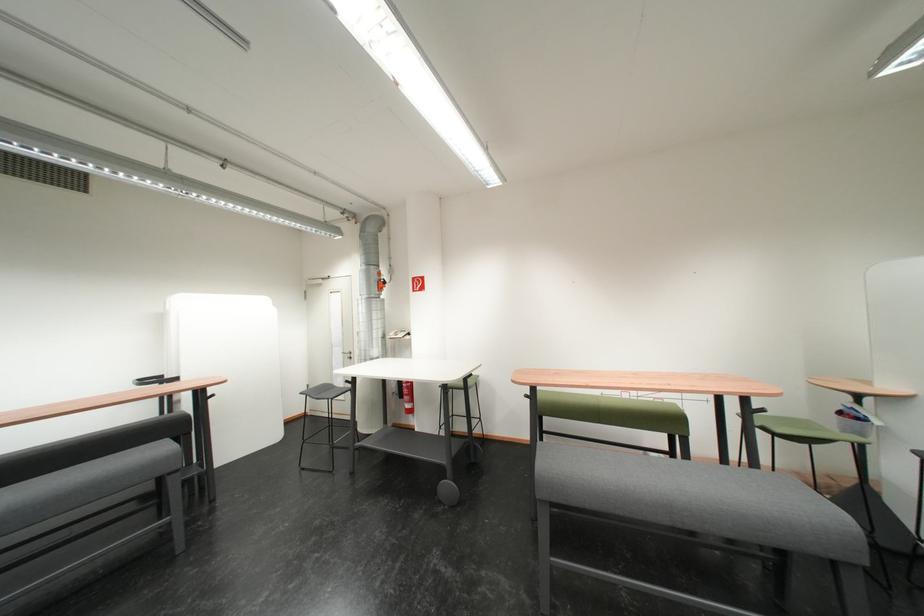
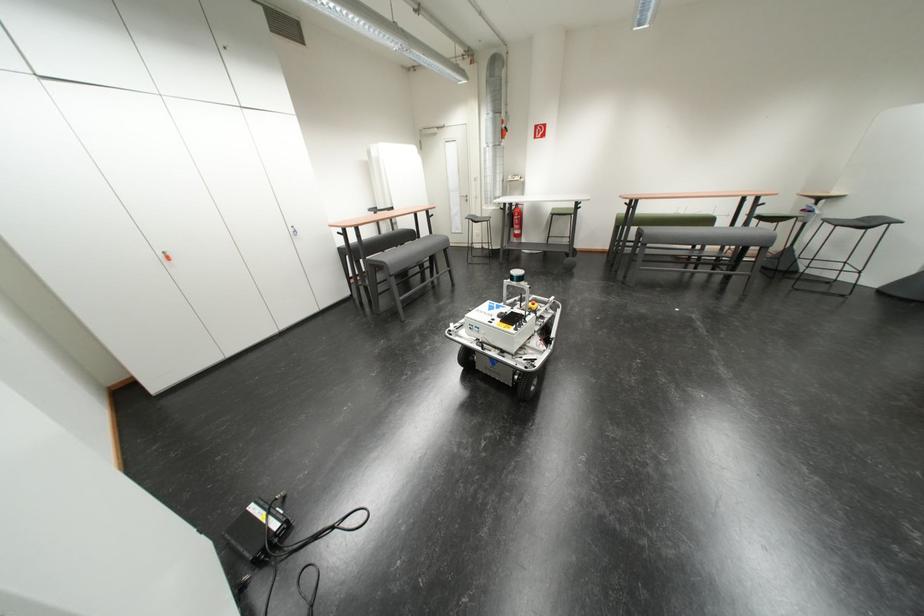
Locate, in the second image, the point that corresponds to point (359, 384) in the first image.

(512, 211)